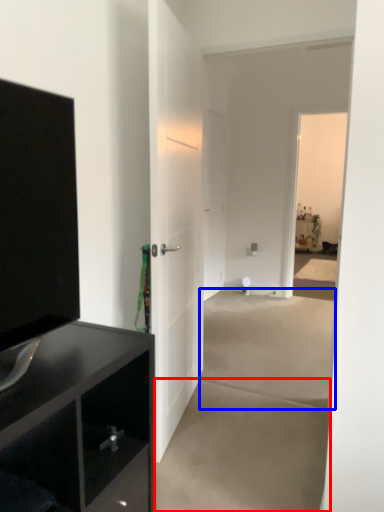
Question: Which object is further to the camera taking this photo, concrete (highlighted by a red box) or concrete (highlighted by a blue box)?

Choices:
 (A) concrete
 (B) concrete

Answer: (B)